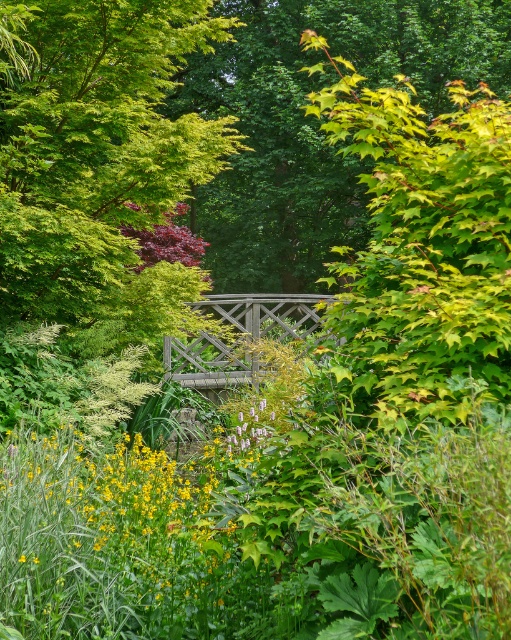
Question: Among these points, which one is nearest to the camera?

Choices:
 (A) (264, 428)
 (B) (227, 260)
 (C) (169, 320)

Answer: (A)

Question: Which is nearer to the green leafy tree at center?

Choices:
 (A) green matte flower at center
 (B) green leafy tree at upper left

Answer: (B)

Question: Can you confirm if green leafy tree at upper left is bigger than green leafy tree at center?

Choices:
 (A) no
 (B) yes

Answer: (A)

Question: Is green leafy tree at upper left closer to the viewer compared to green leafy tree at center?

Choices:
 (A) yes
 (B) no

Answer: (A)

Question: Does green leafy tree at upper left have a smaller size compared to green matte flower at center?

Choices:
 (A) no
 (B) yes

Answer: (A)

Question: Which point is closer to the camera taking this photo?

Choices:
 (A) (250, 416)
 (B) (76, 273)
 (C) (468, 4)

Answer: (A)